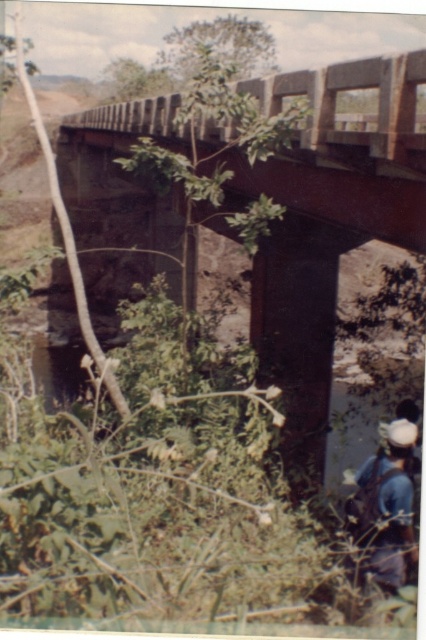
You are standing on the rusty metal bridge at upper center and want to walk to the blue denim jeans at lower right. Which direction should you move relative to the bridge?

The rusty metal bridge at upper center is to the left of the blue denim jeans at lower right, so you should move to the right to reach the blue denim jeans at lower right.

You are standing on the bridge and looking at two points marked on the image. Which point is closer to you, point (x=88, y=285) or point (x=391, y=476)?

Point (x=88, y=285) is closer to you because it is further to the viewer than point (x=391, y=476).

You are a hiker who has just arrived at the scene. You notice the rusty metal bridge at upper center and the blue denim jeans at lower right. Which object is closer to you from your current viewpoint?

The rusty metal bridge at upper center is closer to you because the blue denim jeans at lower right is behind it, meaning the bridge is in front of the jeans and thus nearer to your viewpoint.